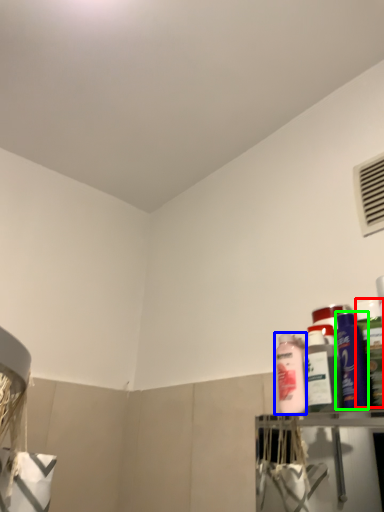
Question: Which object is the closest to the cleaning product (highlighted by a red box)? Choose among these: cleaning product (highlighted by a blue box) or cleaning product (highlighted by a green box).

Choices:
 (A) cleaning product
 (B) cleaning product

Answer: (B)